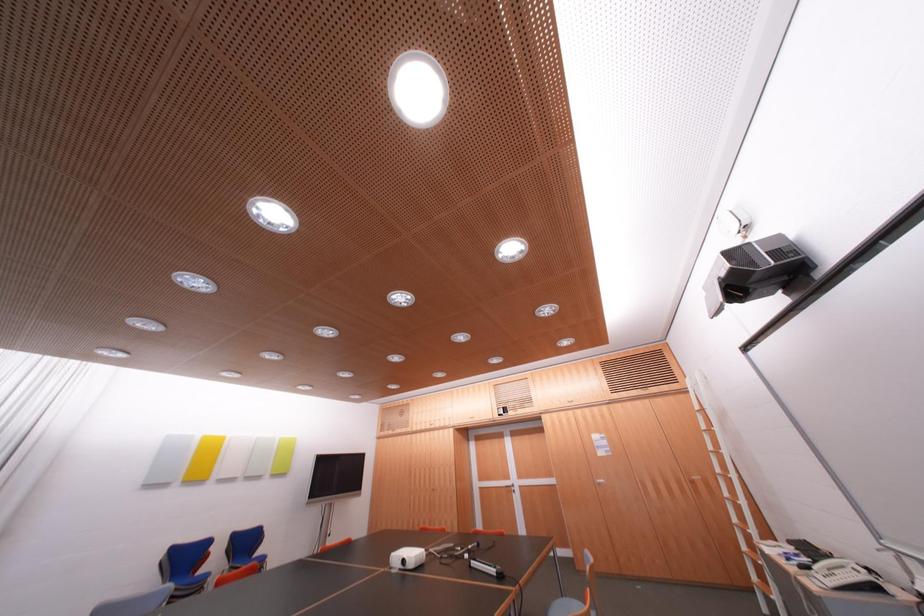
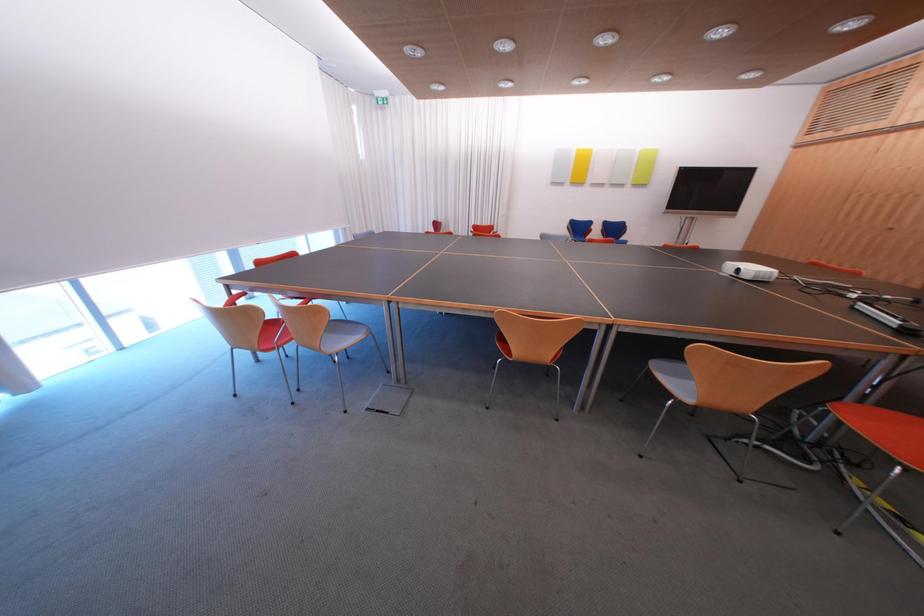
How did the camera likely rotate?

The camera rotated toward left-down.